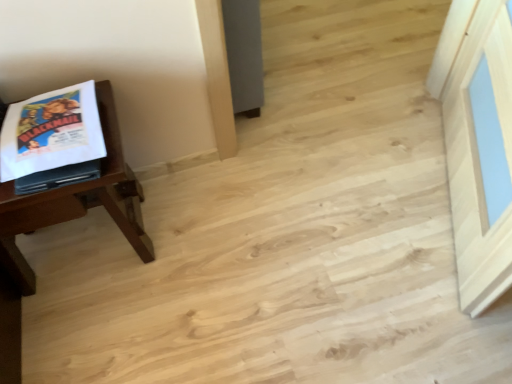
You are a GUI agent. You are given a task and a screenshot of the screen. Output one action in this format:
    pyautogui.click(x=<x>, y=<y>)
    Task: Click on the vacant region under wooden table at left (from a real-world perspective)
    
    Given the screenshot: What is the action you would take?
    [x=84, y=248]